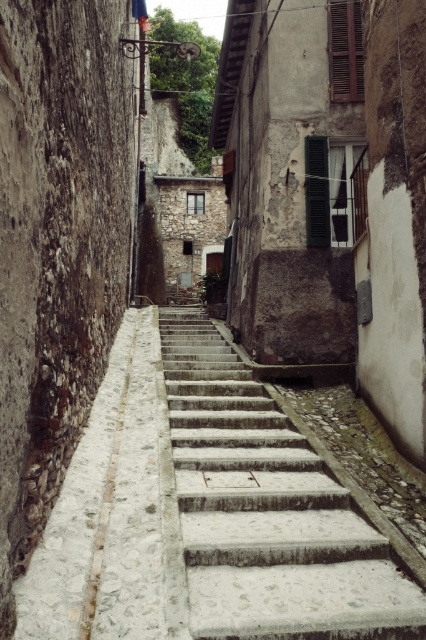
You are a delivery person carrying a large package and need to navigate through the narrow alleyway. The alley has two paths available for you to choose from. One is the smooth concrete stairs at center, and the other is the white stone path at center. Based on their widths, which path should you choose to ensure you can pass through safely?

The smooth concrete stairs at center might be wider than white stone path at center, so you should choose the smooth concrete stairs at center to ensure you can pass through safely.

You are a delivery person carrying a heavy box and need to choose between the smooth concrete stairs at center and the white stone path at center. Which one is wider so you can walk more comfortably?

The white stone path at center is wider than the smooth concrete stairs at center, so you should choose the white stone path at center for more comfortable walking.

Consider the image. You are a delivery person carrying a heavy box and need to reach the apartment above the window with dark green shutters. The smooth concrete stairs at center and the white stone path at center are in your way. Which path should you take to get closer to the window with dark green shutters?

The smooth concrete stairs at center are to the right of the white stone path at center, so taking the smooth concrete stairs at center would bring you closer to the window with dark green shutters.